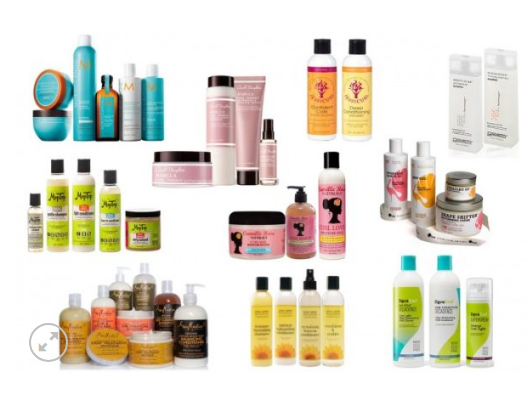
Where is `jars`? The image size is (528, 401). jars is located at coordinates (159, 347), (142, 321), (254, 237), (455, 219), (457, 189), (141, 224), (181, 172), (47, 118), (52, 87).